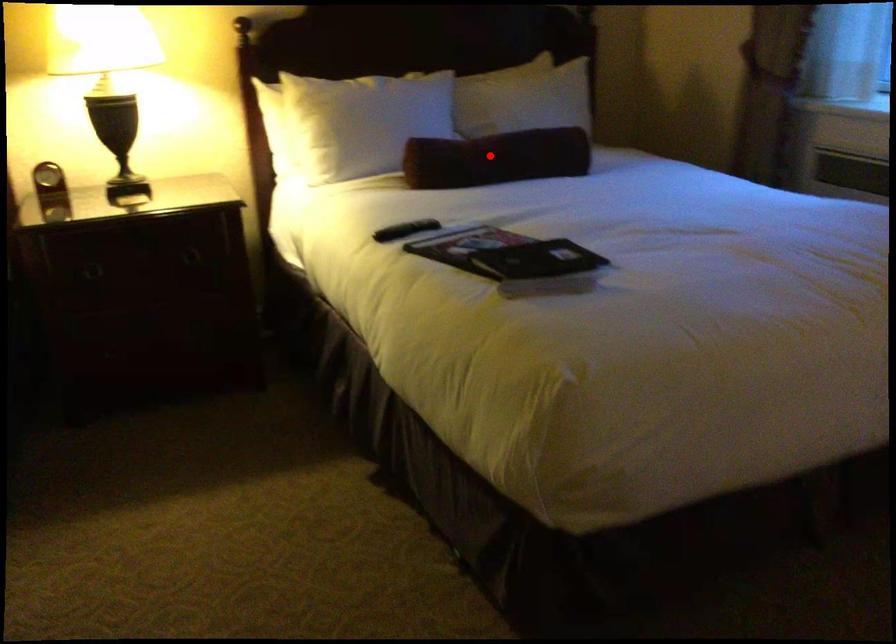
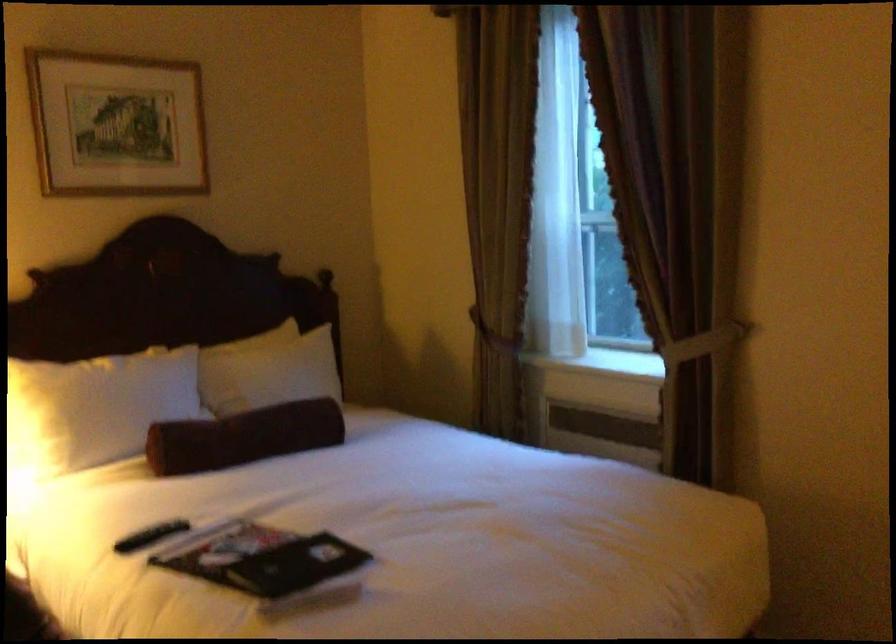
In the second image, find the point that corresponds to the highlighted location in the first image.

(243, 437)